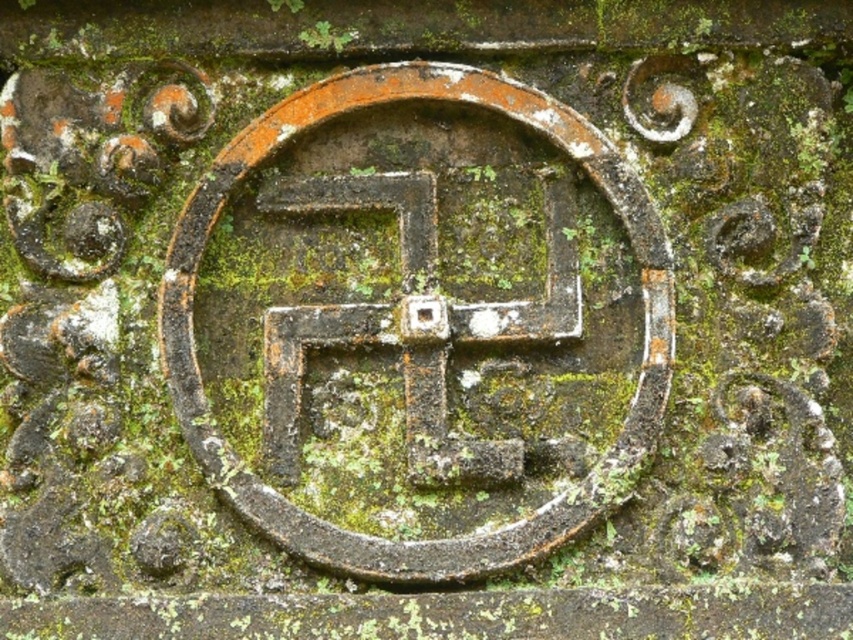
You are an archaeologist examining the stone structure. You notice two symbols, the rusty metal swastika at center and the rusty metal cross at center. How far apart are these two symbols from each other?

The rusty metal swastika at center is 4.18 inches from the rusty metal cross at center.

You are an archaeologist examining the aged stone structure. You notice two symbols at the center of the emblem. Which one is located more to the right? The rusty metal swastika at center or the rusty metal cross at center?

The rusty metal swastika at center is positioned on the right side of the rusty metal cross at center, so the rusty metal swastika at center is more to the right.

You are an art restorer examining the aged stone structure. You need to determine the spatial relationship between the rusty metal swastika at center and the rusty metal cross at center. Which object has a greater width?

The rusty metal swastika at center has a greater width than the rusty metal cross at center according to the description.